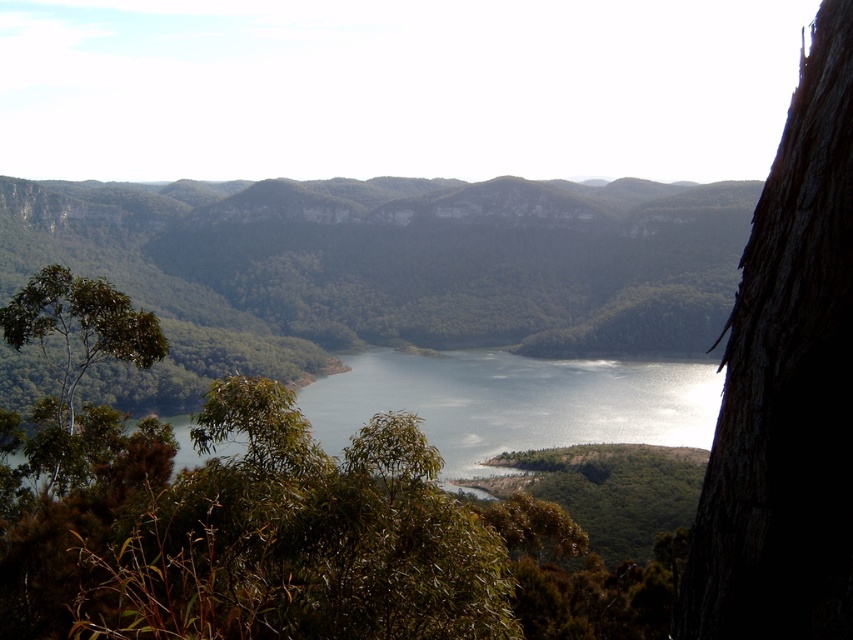
Can you confirm if green leafy forest at center is thinner than green leafy tree at left?

In fact, green leafy forest at center might be wider than green leafy tree at left.

The width and height of the screenshot is (853, 640). In order to click on green leafy forest at center in this screenshot , I will do `click(384, 268)`.

The image size is (853, 640). Identify the location of green leafy forest at center. (384, 268).

Is brown rough bark tree at right smaller than green leafy tree at left?

Correct, brown rough bark tree at right occupies less space than green leafy tree at left.

Can you confirm if brown rough bark tree at right is taller than green leafy tree at left?

No, brown rough bark tree at right is not taller than green leafy tree at left.

Measure the distance between point (x=793, y=120) and camera.

Point (x=793, y=120) is 8.18 meters from camera.

Identify the location of brown rough bark tree at right. The width and height of the screenshot is (853, 640). (786, 385).

Between green leafy forest at center and brown rough bark tree at right, which one is positioned higher?

green leafy forest at center

Is point (474, 296) in front of point (727, 618)?

That is False.

Does point (235, 358) come behind point (779, 522)?

Yes.

The width and height of the screenshot is (853, 640). Find the location of `green leafy forest at center`. green leafy forest at center is located at coordinates (384, 268).